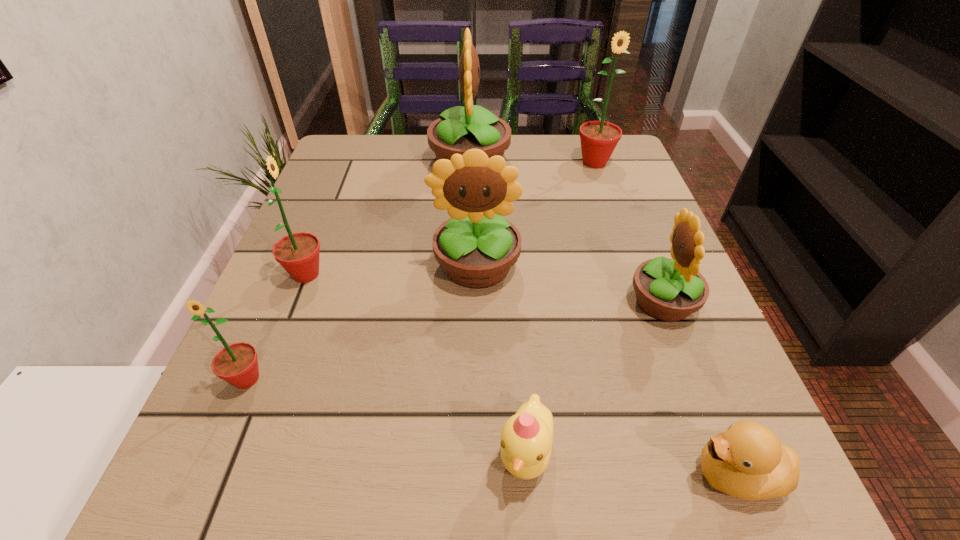
Where is `vacant space located on the face of the right duckling`? This screenshot has height=540, width=960. vacant space located on the face of the right duckling is located at coordinates (585, 475).

The height and width of the screenshot is (540, 960). I want to click on duckling present at the right edge, so click(x=747, y=461).

The height and width of the screenshot is (540, 960). What are the coordinates of `object positioned at the far right corner` in the screenshot? It's located at (598, 139).

Find the location of a particular element. object located in the near right corner section of the desktop is located at coordinates (747, 461).

The image size is (960, 540). What are the coordinates of `free space at the far edge of the desktop` in the screenshot? It's located at (420, 141).

I want to click on vacant space at the near edge, so click(365, 455).

In the image, there is a desktop. At what (x,y) coordinates should I click in order to perform the action: click on free region at the left edge. Please return your answer as a coordinate pair (x, y). The width and height of the screenshot is (960, 540). Looking at the image, I should click on (370, 239).

At what (x,y) coordinates should I click in order to perform the action: click on vacant space at the right edge. Please return your answer as a coordinate pair (x, y). The image size is (960, 540). Looking at the image, I should click on (645, 248).

In the image, there is a desktop. At what (x,y) coordinates should I click in order to perform the action: click on vacant area at the near left corner. Please return your answer as a coordinate pair (x, y). The image size is (960, 540). Looking at the image, I should click on (302, 489).

Locate an element on the screen. This screenshot has height=540, width=960. vacant space at the far right corner of the desktop is located at coordinates (619, 150).